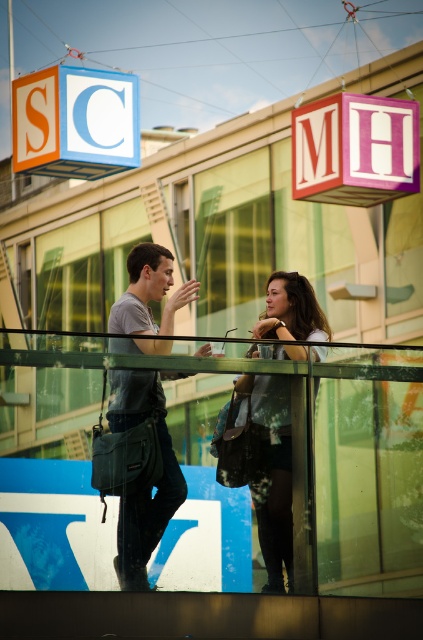
Question: Is orange matte cube at upper left wider than matte black dress at center?

Choices:
 (A) yes
 (B) no

Answer: (A)

Question: Based on their relative distances, which object is nearer to the denim jacket at center?

Choices:
 (A) matte black dress at center
 (B) denim jeans at center
 (C) pink wood sign at upper center
 (D) orange matte cube at upper left

Answer: (B)

Question: Based on their relative distances, which object is nearer to the denim jeans at center?

Choices:
 (A) orange matte cube at upper left
 (B) pink wood sign at upper center
 (C) denim jacket at center

Answer: (C)

Question: Observing the image, what is the correct spatial positioning of denim jeans at center in reference to matte black dress at center?

Choices:
 (A) left
 (B) right

Answer: (A)

Question: Is orange matte cube at upper left closer to the viewer compared to matte black dress at center?

Choices:
 (A) yes
 (B) no

Answer: (B)

Question: Among these points, which one is nearest to the camera?

Choices:
 (A) (263, 316)
 (B) (131, 586)
 (C) (277, 400)

Answer: (B)